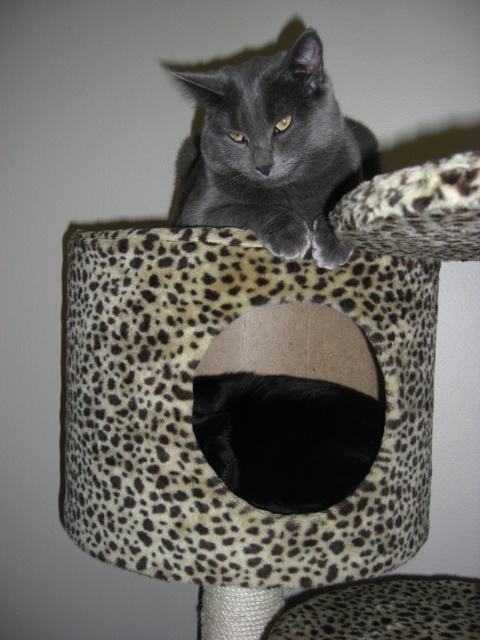
Is point (195, 396) positioned before point (403, 596)?

Yes, point (195, 396) is closer to viewer.

This screenshot has height=640, width=480. I want to click on black fur at center, so click(x=286, y=436).

Between leopard print fabric cat bed at upper center and matte gray cat at upper center, which one appears on the right side from the viewer's perspective?

From the viewer's perspective, leopard print fabric cat bed at upper center appears more on the right side.

Can you confirm if leopard print fabric cat bed at upper center is smaller than matte gray cat at upper center?

No, leopard print fabric cat bed at upper center is not smaller than matte gray cat at upper center.

The image size is (480, 640). Identify the location of leopard print fabric cat bed at upper center. (204, 353).

Identify the location of leopard print fabric cat bed at upper center. The image size is (480, 640). (204, 353).

Can you confirm if matte gray cat at upper center is positioned above leopard print cat bed at center?

Correct, matte gray cat at upper center is located above leopard print cat bed at center.

The height and width of the screenshot is (640, 480). I want to click on matte gray cat at upper center, so click(x=272, y=152).

Locate an element on the screen. matte gray cat at upper center is located at coordinates (272, 152).